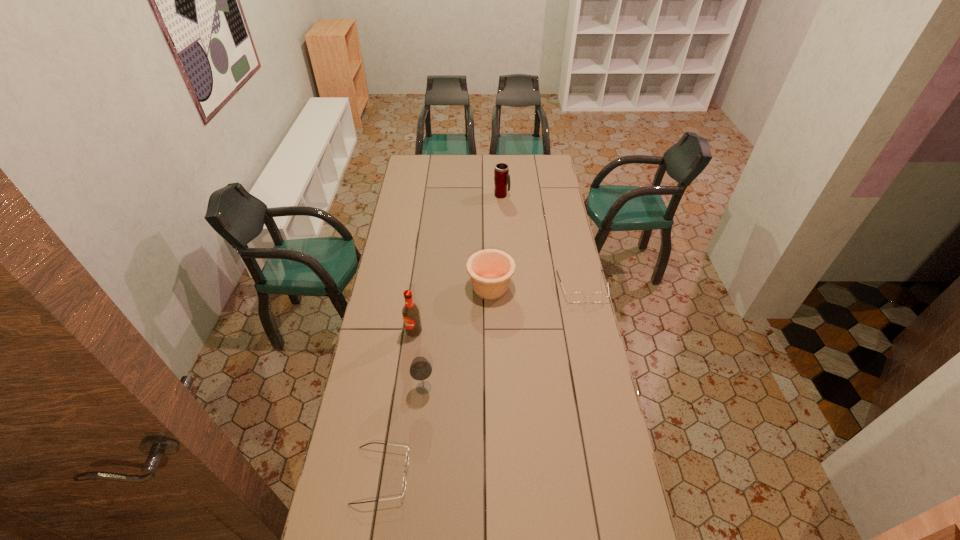
Please point a space for a new spectacles to maintain equal intervals. Please provide its 2D coordinates. Your answer should be formatted as a tuple, i.e. [(x, y)], where the tuple contains the x and y coordinates of a point satisfying the conditions above.

[(499, 364)]